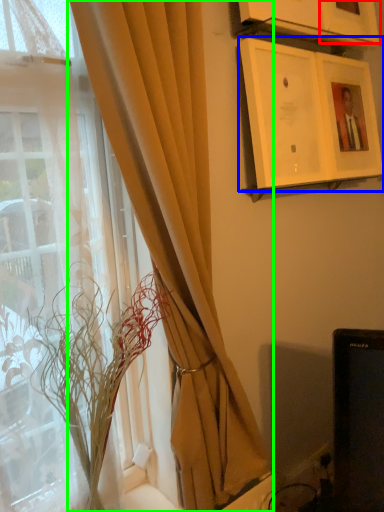
Question: Based on their relative distances, which object is farther from picture frame (highlighted by a red box)? Choose from picture frame (highlighted by a blue box) and curtain (highlighted by a green box).

Choices:
 (A) picture frame
 (B) curtain

Answer: (B)